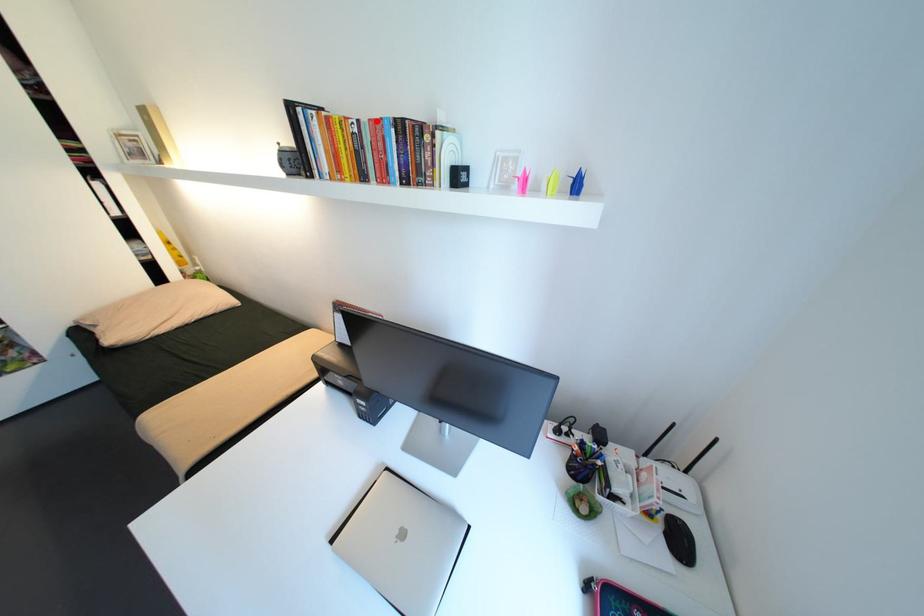
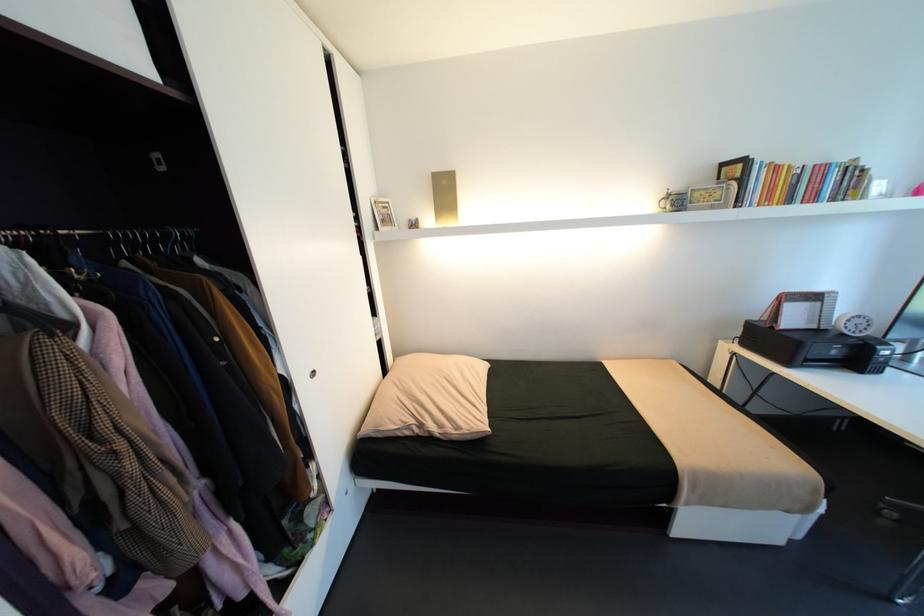
Find the pixel in the second image that matches the highlighted location in the first image.

(821, 166)